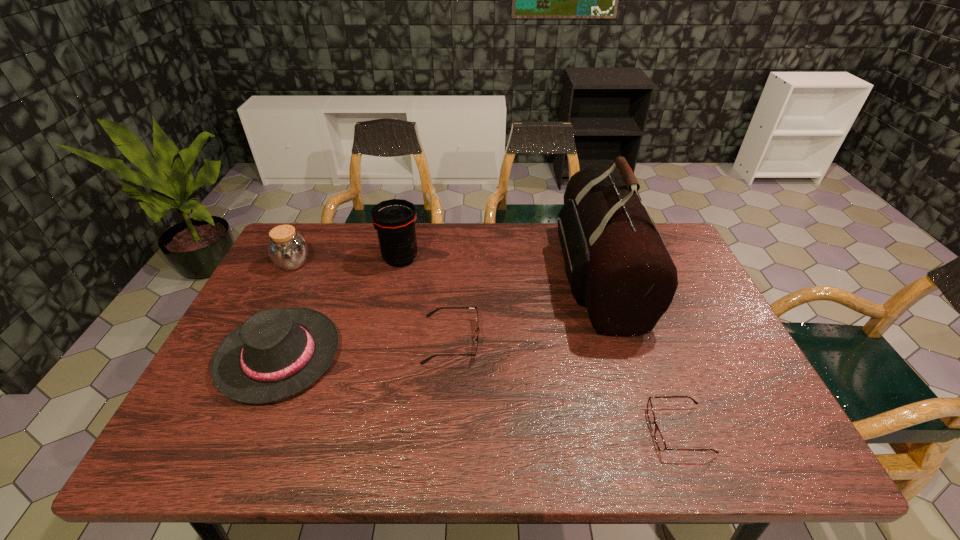
Where is `vacant area that lies between the shorter spectacles and the dress hat`? Image resolution: width=960 pixels, height=540 pixels. vacant area that lies between the shorter spectacles and the dress hat is located at coordinates (479, 393).

This screenshot has height=540, width=960. I want to click on vacant space in between the farther spectacles and the jar, so click(x=372, y=302).

Choose which object is the second nearest neighbor to the third object from left to right. Please provide its 2D coordinates. Your answer should be formatted as a tuple, i.e. [(x, y)], where the tuple contains the x and y coordinates of a point satisfying the conditions above.

[(429, 314)]

Choose which object is the fifth nearest neighbor to the shorter spectacles. Please provide its 2D coordinates. Your answer should be formatted as a tuple, i.e. [(x, y)], where the tuple contains the x and y coordinates of a point satisfying the conditions above.

[(288, 250)]

In order to click on free space that satisfies the following two spatial constraints: 1. on the front-facing side of the taller spectacles; 2. on the front side of the dress hat in this screenshot , I will do `click(450, 356)`.

Where is `free point that satisfies the following two spatial constraints: 1. on the back side of the telephoto lens; 2. on the right side of the jar`? Image resolution: width=960 pixels, height=540 pixels. free point that satisfies the following two spatial constraints: 1. on the back side of the telephoto lens; 2. on the right side of the jar is located at coordinates (296, 259).

Where is `free spot that satisfies the following two spatial constraints: 1. on the front-facing side of the third object from right to left; 2. on the front side of the dress hat`? The height and width of the screenshot is (540, 960). free spot that satisfies the following two spatial constraints: 1. on the front-facing side of the third object from right to left; 2. on the front side of the dress hat is located at coordinates (450, 356).

At what (x,y) coordinates should I click in order to perform the action: click on vacant position in the image that satisfies the following two spatial constraints: 1. on the front-facing side of the left spectacles; 2. on the front side of the dress hat. Please return your answer as a coordinate pair (x, y). Image resolution: width=960 pixels, height=540 pixels. Looking at the image, I should click on (450, 356).